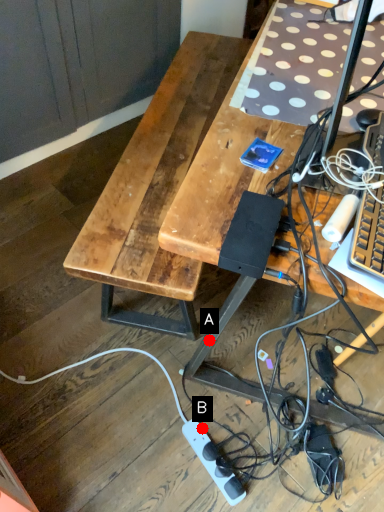
Question: Two points are circled on the image, labeled by A and B beside each circle. Which of the following is the farthest from the observer?

Choices:
 (A) A is further
 (B) B is further

Answer: (B)